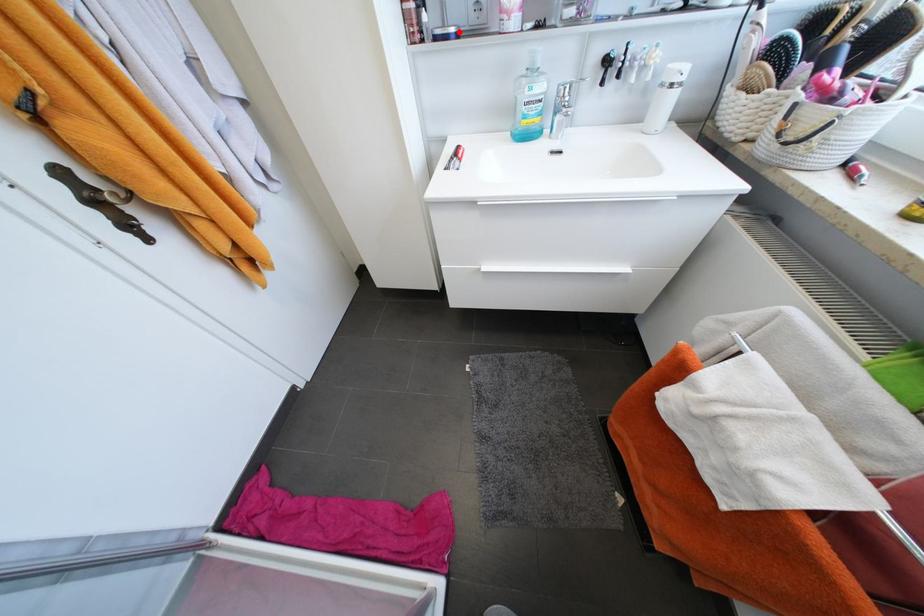
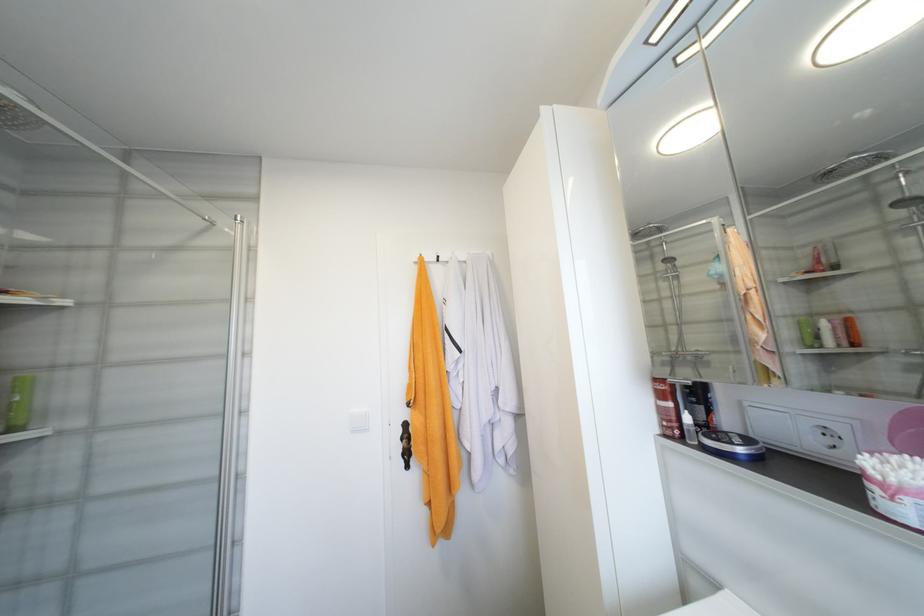
The point at the highlighted location is marked in the first image. Where is the corresponding point in the second image?

(747, 451)